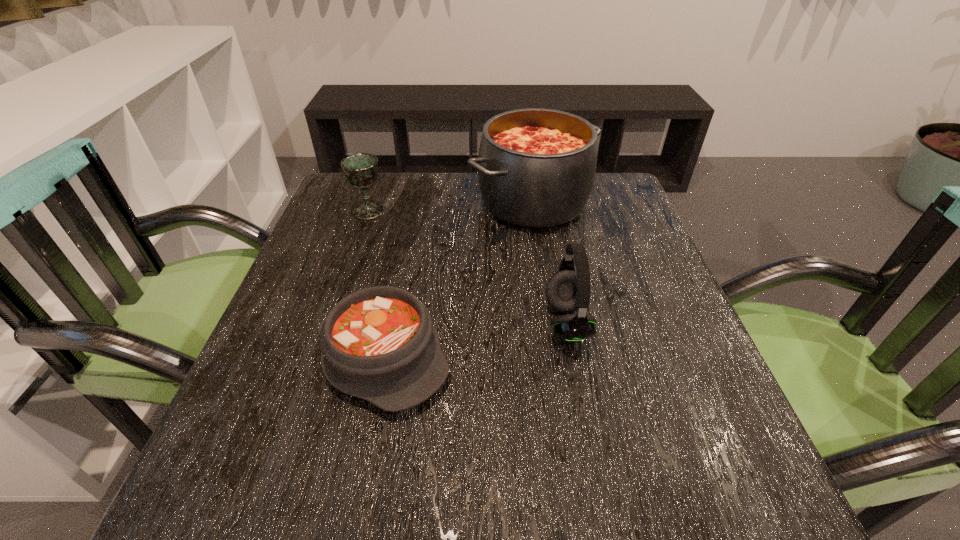
You are a GUI agent. You are given a task and a screenshot of the screen. Output one action in this format:
    pyautogui.click(x=<x>, y=<y>)
    Task: Click on the free space located on the right of the third tallest object
    The width and height of the screenshot is (960, 540).
    Given the screenshot: What is the action you would take?
    pyautogui.click(x=486, y=211)

Identify the location of vacant space situated 0.090m on the front of the nearer casserole. The width and height of the screenshot is (960, 540). coord(358,478).

Locate an element on the screen. The image size is (960, 540). casserole positioned at the far edge is located at coordinates (536, 167).

This screenshot has height=540, width=960. I want to click on chalice present at the far edge, so click(x=361, y=170).

Find the location of a particular element. This screenshot has width=960, height=540. chalice that is at the left edge is located at coordinates (361, 170).

Find the location of `casserole situated at the left edge`. casserole situated at the left edge is located at coordinates (379, 344).

Where is `object located at the right edge`? The image size is (960, 540). object located at the right edge is located at coordinates (536, 167).

Where is `object that is positioned at the far left corner`? object that is positioned at the far left corner is located at coordinates (361, 170).

Image resolution: width=960 pixels, height=540 pixels. I want to click on object present at the far right corner, so click(536, 167).

In the image, there is a desktop. Identify the location of blank space at the far edge. (428, 191).